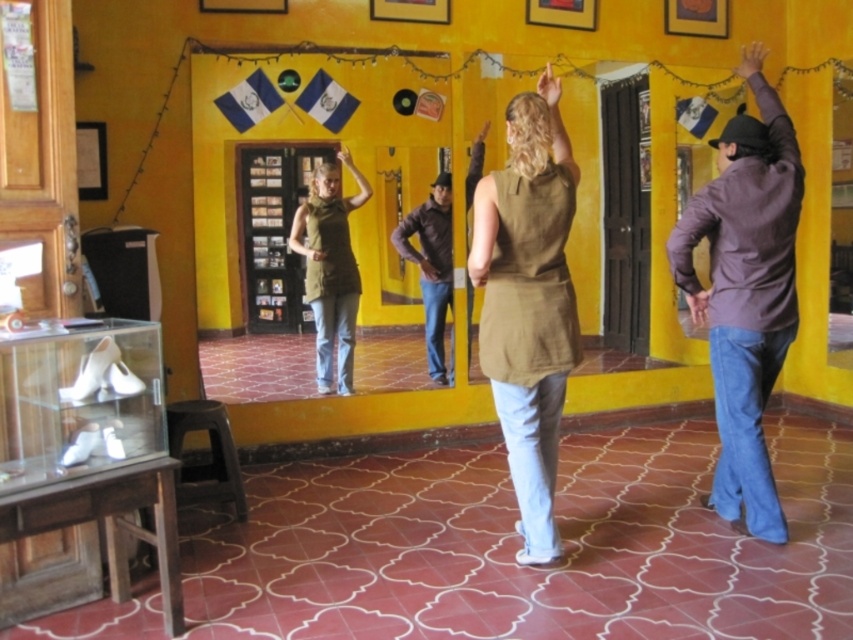
You are a dancer preparing to change outfits. You have two options in the studio, the dark purple jacket at upper right and the green matte vest at center. Which one is smaller in size?

The dark purple jacket at upper right is smaller in size compared to the green matte vest at center.